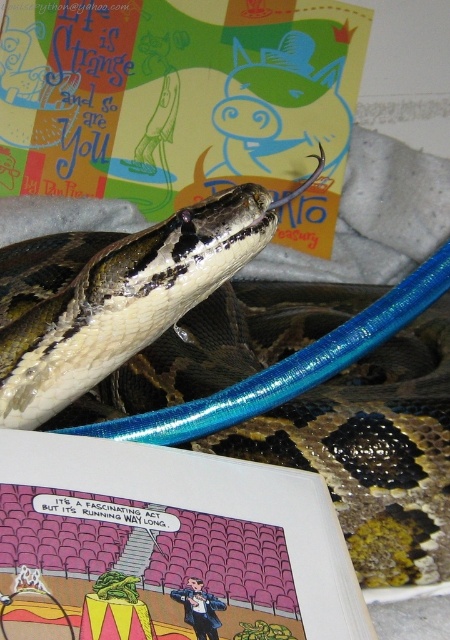
Question: Can you confirm if shiny brown snake at center is positioned above comic book paper at upper center?

Choices:
 (A) no
 (B) yes

Answer: (B)

Question: Which of these objects is positioned closest to the matte paper comic book at upper center?

Choices:
 (A) comic book paper at upper center
 (B) shiny brown snake at center

Answer: (B)

Question: Considering the real-world distances, which object is farthest from the shiny brown snake at center?

Choices:
 (A) comic book paper at upper center
 (B) matte paper comic book at upper center

Answer: (B)

Question: From the image, what is the correct spatial relationship of shiny brown snake at center in relation to matte paper comic book at upper center?

Choices:
 (A) above
 (B) below

Answer: (B)

Question: Does shiny brown snake at center appear on the right side of comic book paper at upper center?

Choices:
 (A) no
 (B) yes

Answer: (B)

Question: Which of the following is the closest to the observer?

Choices:
 (A) shiny brown snake at center
 (B) matte paper comic book at upper center

Answer: (A)